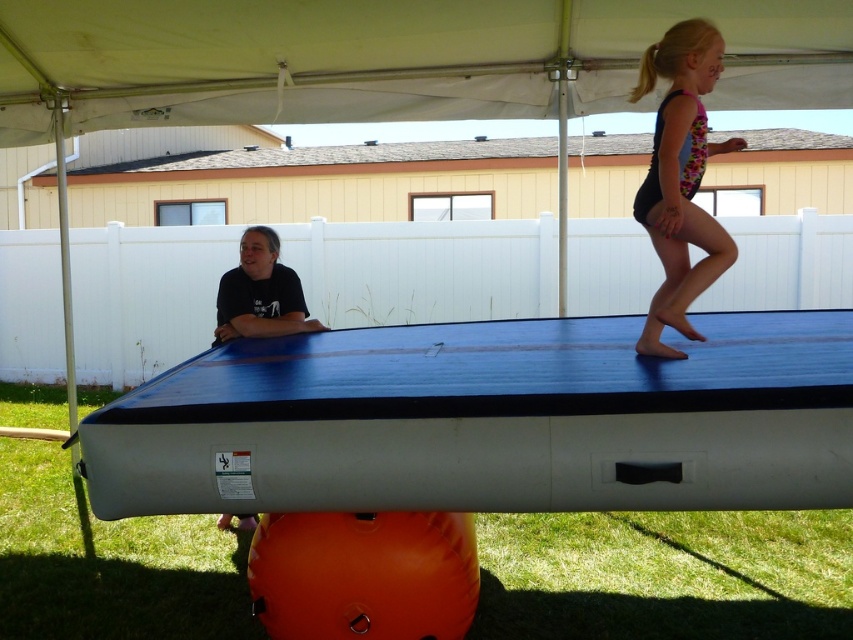
Question: Estimate the real-world distances between objects in this image. Which object is farther from the black matte shirt at left?

Choices:
 (A) multicolored leotard at upper right
 (B) blue rubber mat at upper center

Answer: (A)

Question: Can you confirm if blue rubber mat at upper center is positioned to the right of black matte shirt at left?

Choices:
 (A) yes
 (B) no

Answer: (A)

Question: Does blue rubber mat at upper center have a larger size compared to multicolored leotard at upper right?

Choices:
 (A) no
 (B) yes

Answer: (B)

Question: Which point is closer to the camera?

Choices:
 (A) black matte shirt at left
 (B) blue rubber mat at upper center

Answer: (B)

Question: Which is nearer to the multicolored leotard at upper right?

Choices:
 (A) black matte shirt at left
 (B) blue rubber mat at upper center

Answer: (B)

Question: Is blue rubber mat at upper center above black matte shirt at left?

Choices:
 (A) yes
 (B) no

Answer: (B)